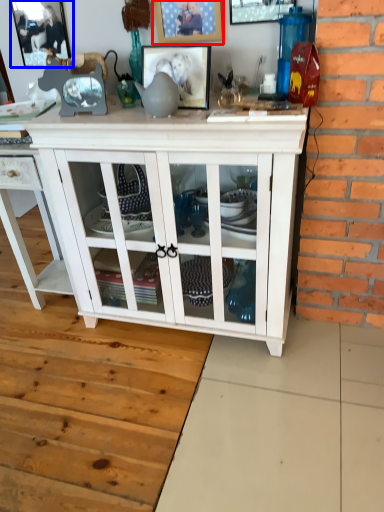
Question: Which of the following is the farthest to the observer, picture frame (highlighted by a red box) or picture frame (highlighted by a blue box)?

Choices:
 (A) picture frame
 (B) picture frame

Answer: (B)